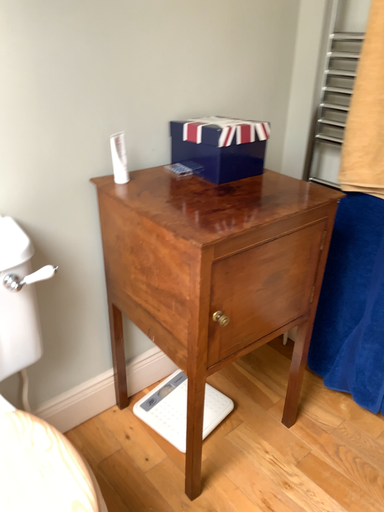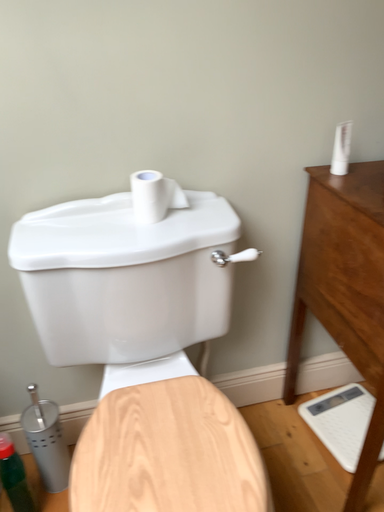
Question: Which way did the camera rotate in the video?

Choices:
 (A) rotated left
 (B) rotated right

Answer: (A)